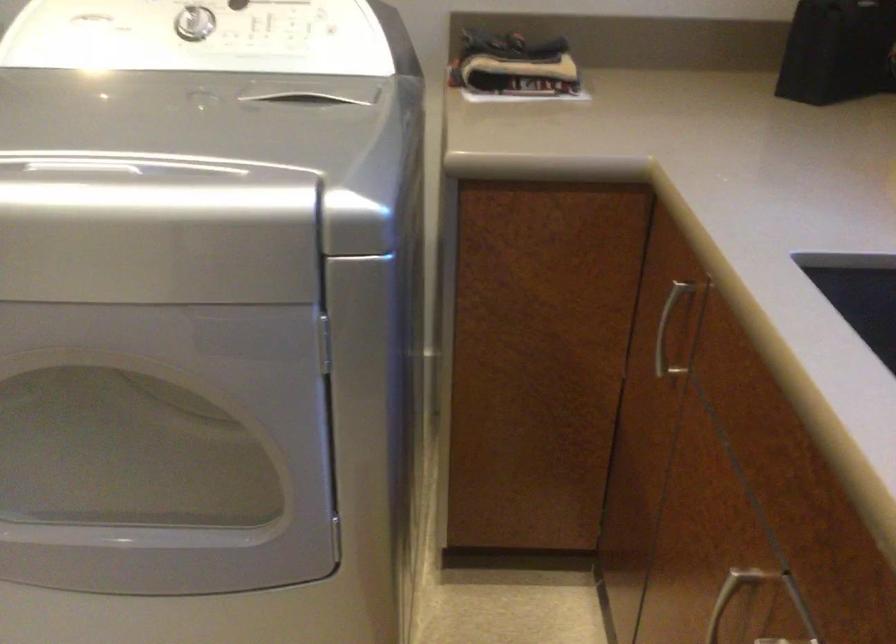
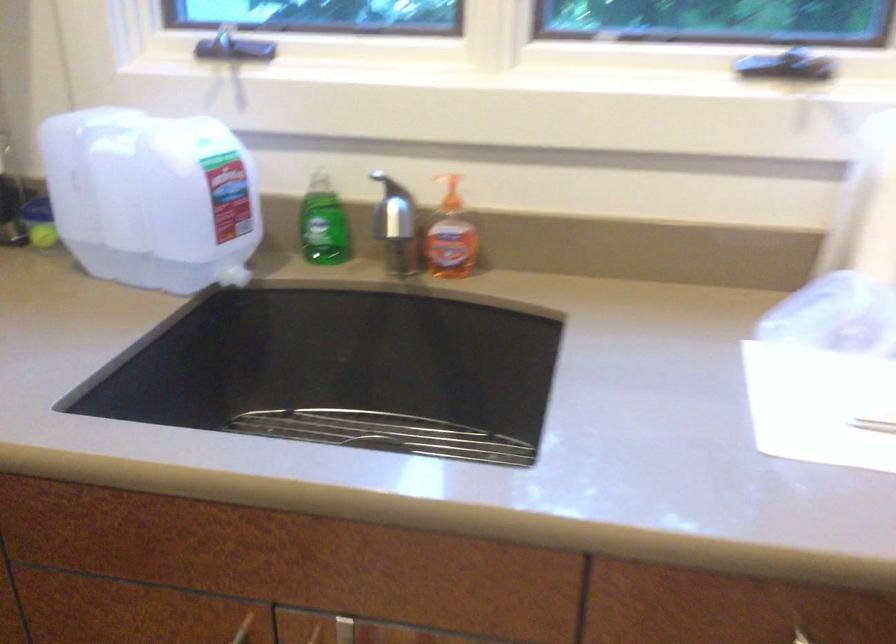
The first image is from the beginning of the video and the second image is from the end. How did the camera likely rotate when shooting the video?

The rotation direction of the camera is right-down.